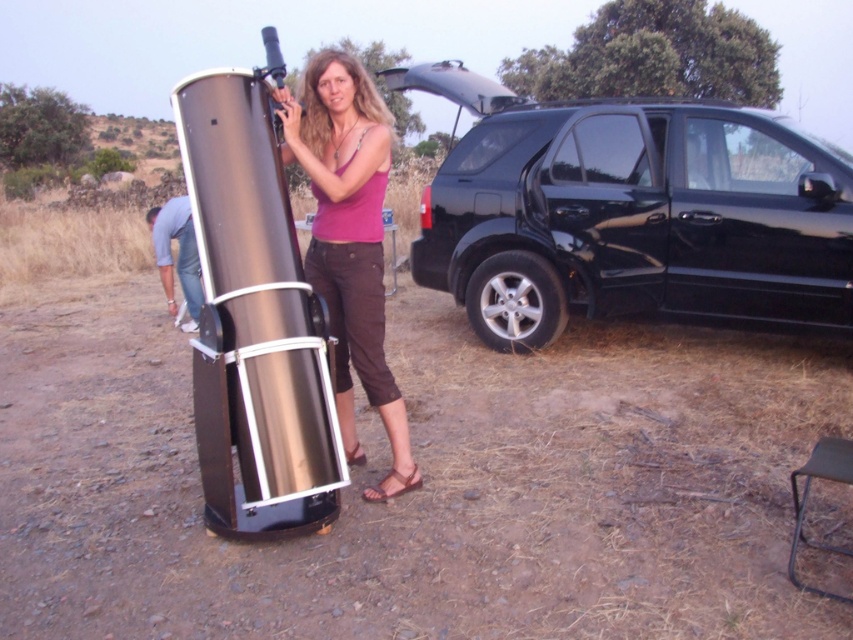
Is black glossy suv at right bigger than brushed metal shoe at lower left?

Indeed, black glossy suv at right has a larger size compared to brushed metal shoe at lower left.

Can you confirm if black glossy suv at right is wider than brushed metal shoe at lower left?

Correct, the width of black glossy suv at right exceeds that of brushed metal shoe at lower left.

The width and height of the screenshot is (853, 640). In order to click on black glossy suv at right in this screenshot , I will do click(630, 212).

Which is more to the right, black glossy suv at right or matte pink tank top at center?

black glossy suv at right is more to the right.

Describe the element at coordinates (630, 212) in the screenshot. I see `black glossy suv at right` at that location.

At what (x,y) coordinates should I click in order to perform the action: click on black glossy suv at right. Please return your answer as a coordinate pair (x, y). The height and width of the screenshot is (640, 853). Looking at the image, I should click on (630, 212).

Who is lower down, matte pink tank top at center or brushed metal shoe at lower left?

matte pink tank top at center is lower down.

This screenshot has height=640, width=853. What are the coordinates of `matte pink tank top at center` in the screenshot? It's located at (349, 241).